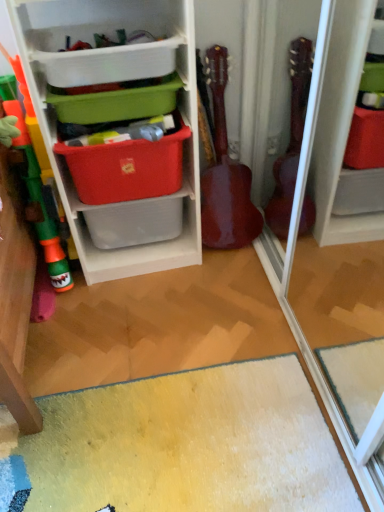
What are the coordinates of `vacant region in front of plastic storage at left` in the screenshot? It's located at (140, 319).